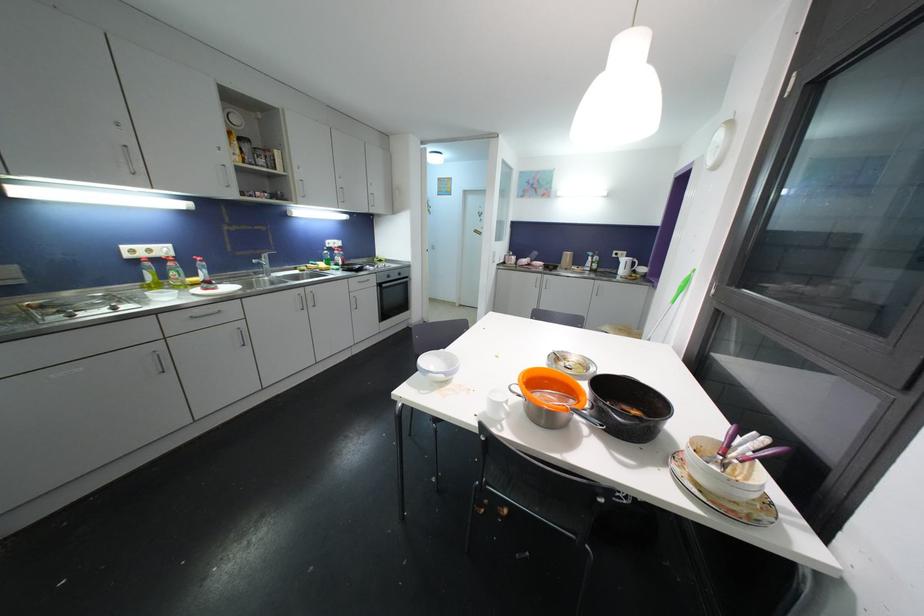
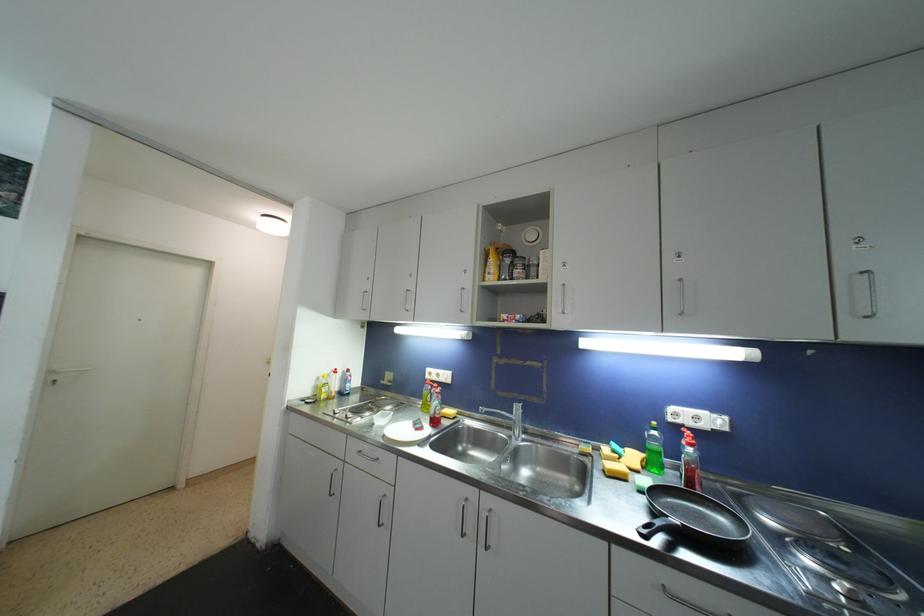
The point at (x=339, y=254) is marked in the first image. Where is the corresponding point in the second image?

(687, 445)